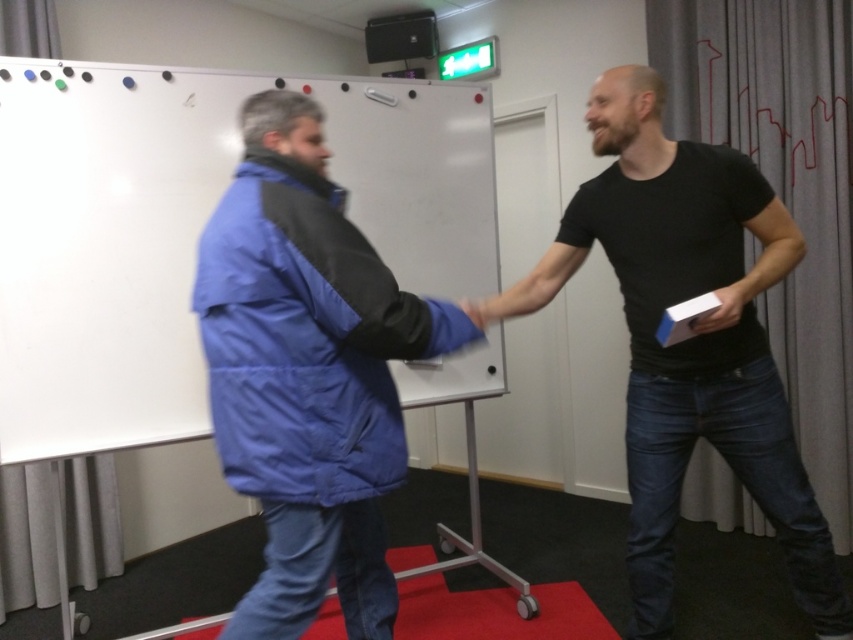
You are a photographer setting up for a group photo in the conference room. You need to position the blue puffy jacket at center and the black matte shirt at center so that both fit within a 1.2 meter wide frame. Given their widths, can both individuals stand side by side without overlapping?

The blue puffy jacket at center is narrower than the black matte shirt at center. However, since the total width of both together may exceed 1.2 meters, they might need to adjust their positions to fit within the frame.

You are a photographer positioned to the side of the scene. You need to capture a clear photo of the black matte shirt at center without the matte black hand at center blocking it. Is this possible given their positions?

The matte black hand at center is behind the black matte shirt at center, so it will not block the view of the black matte shirt at center in the photo.